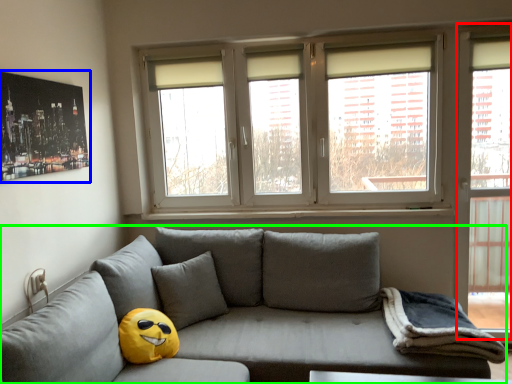
Question: Based on their relative distances, which object is farther from glass door (highlighted by a red box)? Choose from picture frame (highlighted by a blue box) and studio couch (highlighted by a green box).

Choices:
 (A) picture frame
 (B) studio couch

Answer: (A)